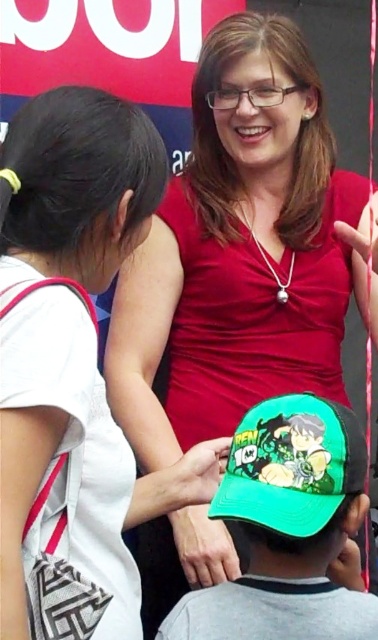
Is point (249, 339) positioned after point (252, 440)?

Yes, it is.

Does point (264, 305) lie in front of point (280, 416)?

No, it is not.

At what (x,y) coordinates should I click in order to perform the action: click on matte green cap at center. Please return your answer as a coordinate pair (x, y). Looking at the image, I should click on 240,252.

What are the coordinates of `matte green cap at center` in the screenshot? It's located at (240, 252).

Between green fabric cap at center and green fabric cap at lower center, which one is positioned lower?

green fabric cap at lower center is below.

Which of these two, green fabric cap at center or green fabric cap at lower center, stands shorter?

green fabric cap at lower center

Describe the element at coordinates (74, 369) in the screenshot. This screenshot has width=378, height=640. I see `green fabric cap at center` at that location.

This screenshot has width=378, height=640. In order to click on green fabric cap at center in this screenshot , I will do 74,369.

How much distance is there between matte green cap at center and green fabric cap at center?

The distance of matte green cap at center from green fabric cap at center is 80.74 centimeters.

Who is positioned more to the right, matte green cap at center or green fabric cap at center?

matte green cap at center

Who is more distant from viewer, [164,419] or [13,424]?

The point [164,419] is more distant.

Find the location of a particular element. matte green cap at center is located at coordinates (240, 252).